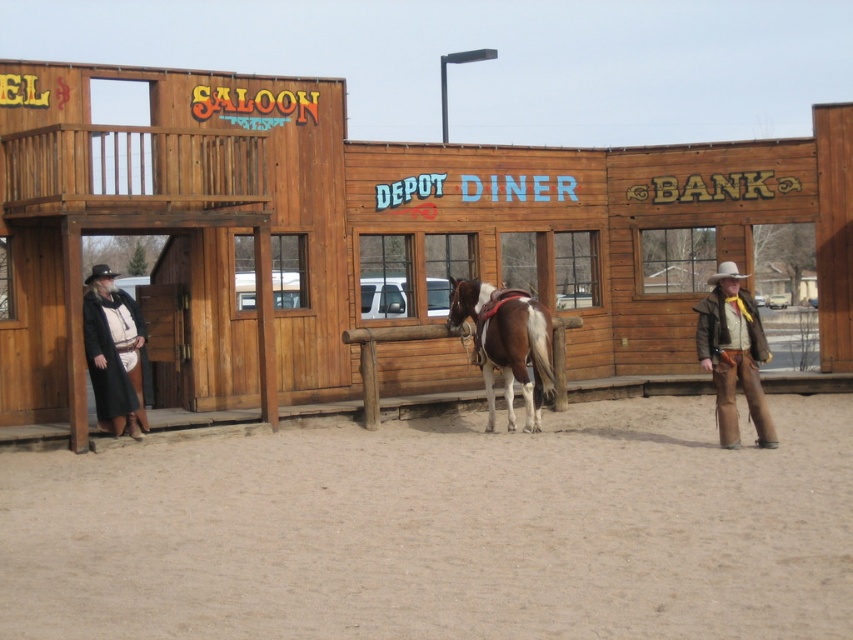
You are a photographer planning to take a picture of the Western town scene. You have the brown glossy horse at center and the brown leather jacket at right in your frame. Based on their sizes, which object will appear bigger in your photo?

The brown glossy horse at center will appear bigger in the photo because it is larger in size than the brown leather jacket at right.

You are a stunt double in a Western movie and need to retrieve both the brown leather jacket at right and the brown leather cowboy hat at center. If your reach is 70 centimeters, can you grab both items without moving your feet?

The distance between the brown leather jacket at right and the brown leather cowboy hat at center is 76.24 centimeters, which is slightly longer than your 70 centimeter reach. Therefore, you cannot grab both items without moving your feet.